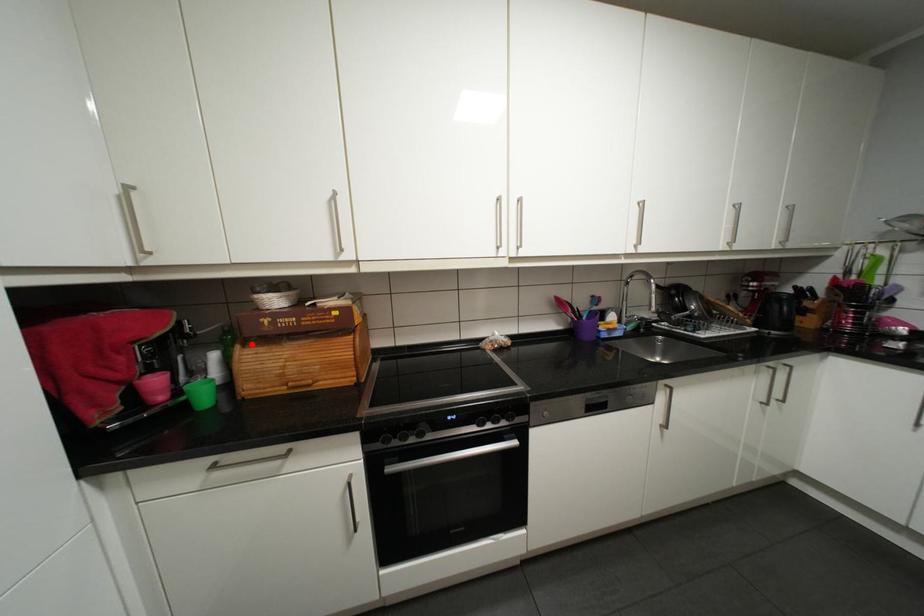
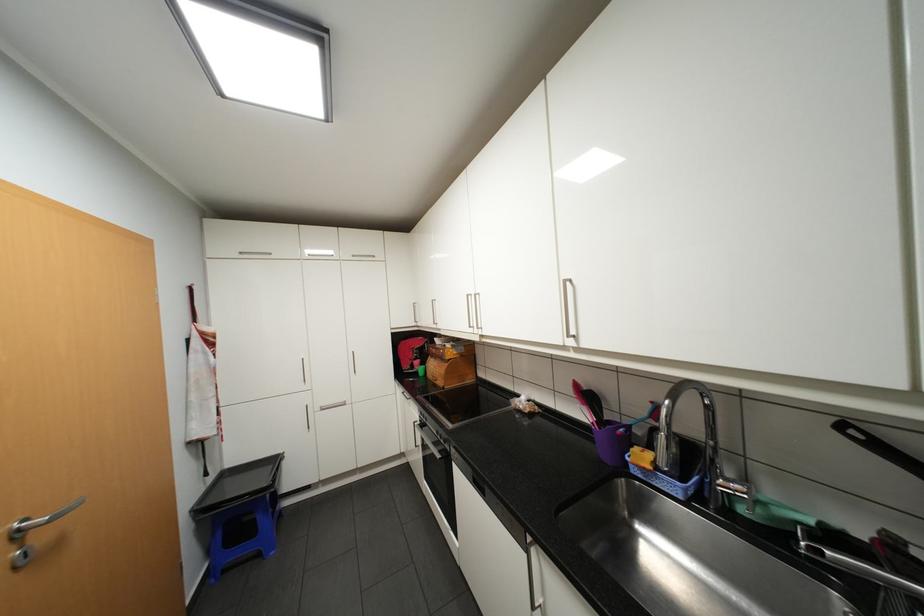
The point at the highlighted location is marked in the first image. Where is the corresponding point in the second image?

(440, 355)